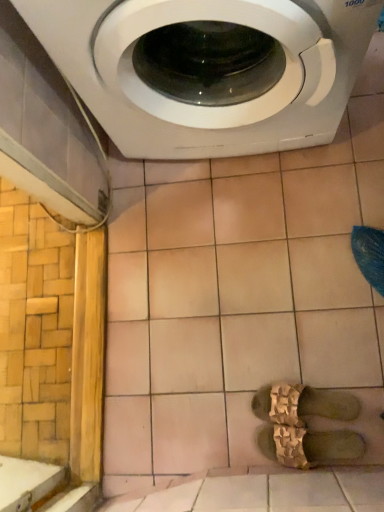
I want to click on free space above beige ceramic tile at upper center (from a real-world perspective), so click(239, 306).